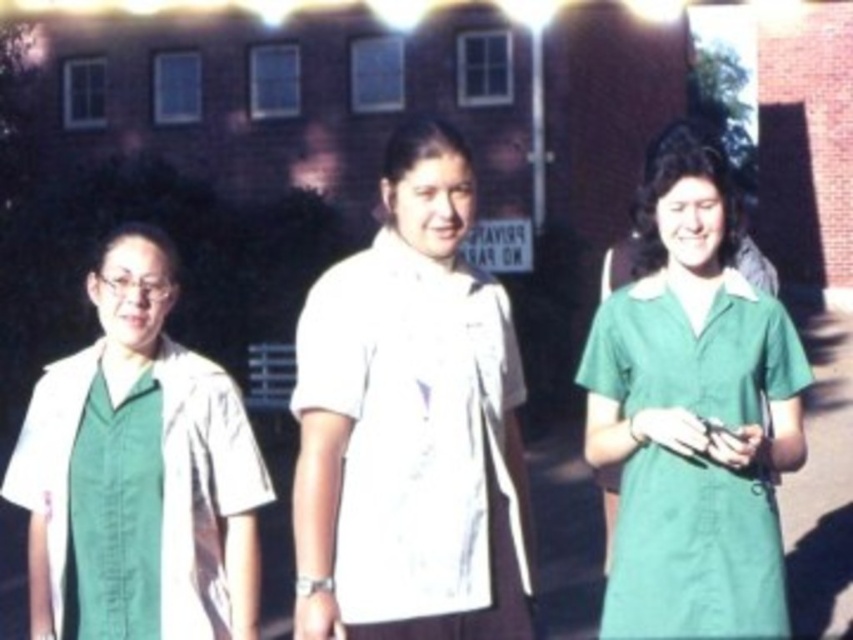
Question: Is green fabric dress at center to the left of green fabric shirt at center from the viewer's perspective?

Choices:
 (A) no
 (B) yes

Answer: (A)

Question: Based on their relative distances, which object is nearer to the green fabric shirt at center?

Choices:
 (A) white cotton shirt at center
 (B) green fabric dress at center

Answer: (A)

Question: Which point is closer to the camera taking this photo?

Choices:
 (A) (770, 371)
 (B) (508, 502)
 (C) (61, 496)

Answer: (B)

Question: Does green fabric shirt at center have a smaller size compared to white cotton shirt at center?

Choices:
 (A) no
 (B) yes

Answer: (A)

Question: Can you confirm if green fabric dress at center is smaller than green fabric shirt at center?

Choices:
 (A) yes
 (B) no

Answer: (B)

Question: Which point is farther from the camera taking this photo?

Choices:
 (A) (399, 436)
 (B) (84, 387)

Answer: (B)